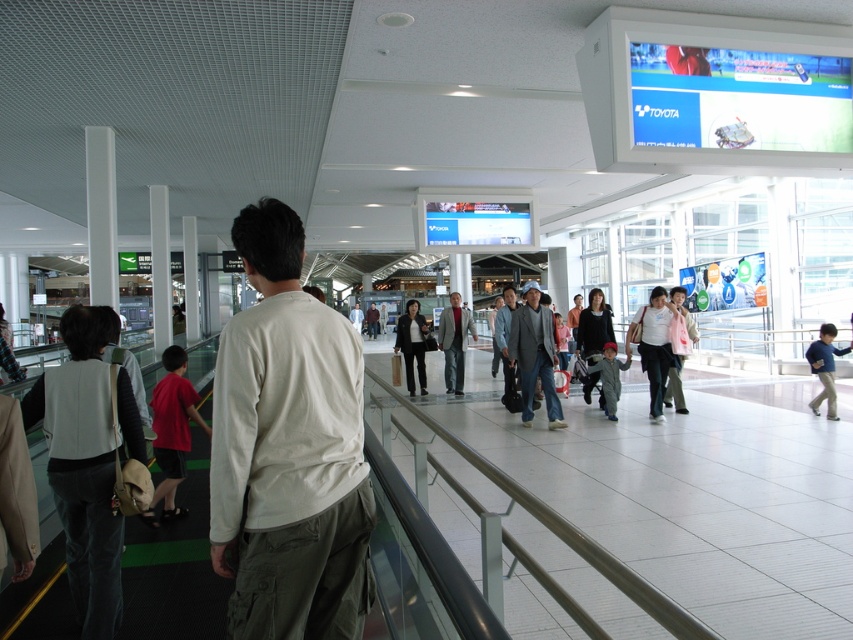
You are a traveler in the transportation hub and notice two jackets hanging on a coat rack. The jackets are the matte pink jacket at center and the denim jacket at center. Which jacket is positioned lower on the coat rack?

The matte pink jacket at center is below the denim jacket at center, so it is positioned lower on the coat rack.

You are observing a crowd in a transportation hub and notice two jackets. The first is a dark gray jacket at center, and the second is a matte pink jacket at center. From your vantage point, which jacket is positioned to the left?

The dark gray jacket at center is positioned to the left of the matte pink jacket at center.